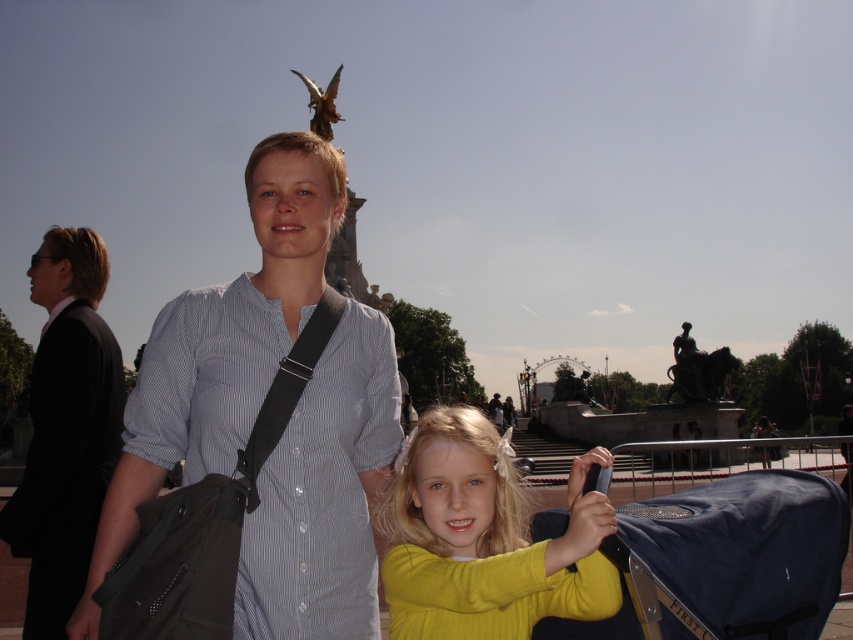
Based on the photo, you are a photographer trying to capture a photo of the blue fabric baby carriage at lower right and the matte black shirt at center. Which object should you focus on first if you want to ensure both are in focus without adjusting the camera settings?

The blue fabric baby carriage at lower right is below matte black shirt at center, so you should focus on the matte black shirt at center first to ensure both are in focus since it is closer to the camera.

You are a photographer trying to capture a photo of the blue fabric baby carriage at lower right without including the child in the frame. Based on their current positions, is this possible?

The blue fabric baby carriage at lower right is positioned at point [741,540]. Since the child is standing closer to the camera, it may block the view of the carriage. To capture the carriage without the child, you would need to adjust your angle or move around the scene to ensure the child is not in front of the carriage.

From the picture: You are a photographer trying to capture a photo of the matte blue shirt at center and the blue fabric baby carriage at lower right. Which object should you focus on first if you want to ensure both are in focus without adjusting the camera settings?

The matte blue shirt at center is thinner than the blue fabric baby carriage at lower right, so you should focus on the blue fabric baby carriage at lower right first because it is larger and will require more precise focus to ensure both objects are in focus.